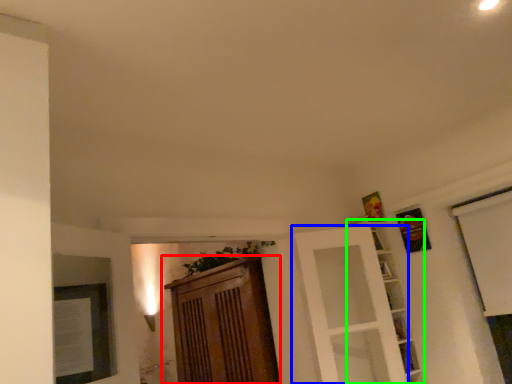
Question: Considering the real-world distances, which object is farthest from cabinetry (highlighted by a red box)? door (highlighted by a blue box) or shelf (highlighted by a green box)?

Choices:
 (A) door
 (B) shelf

Answer: (B)